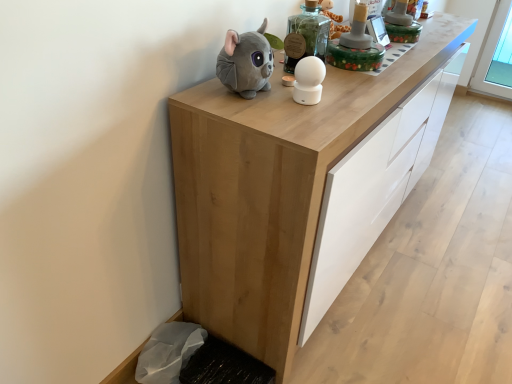
You are a GUI agent. You are given a task and a screenshot of the screen. Output one action in this format:
    pyautogui.click(x=<x>, y=<y>)
    Task: Click on the free space to the left of soft gray plush toy at upper center, the 1th toy positioned from the left
    
    Given the screenshot: What is the action you would take?
    pyautogui.click(x=197, y=93)